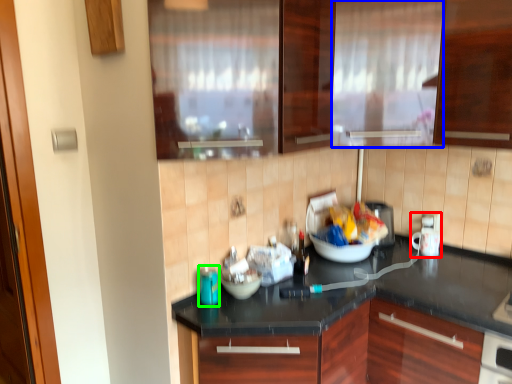
Question: Based on their relative distances, which object is nearer to appliance (highlighted by a red box)? Choose from curtain (highlighted by a blue box) and appliance (highlighted by a green box).

Choices:
 (A) curtain
 (B) appliance

Answer: (A)